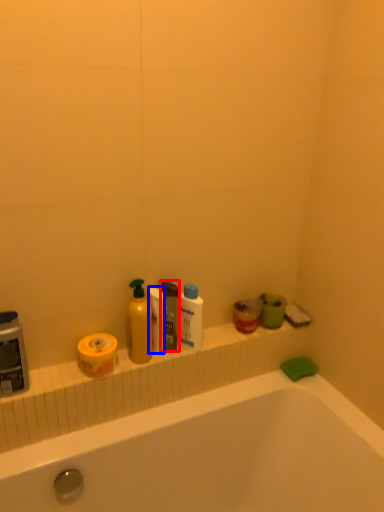
Question: Among these objects, which one is farthest to the camera, mouthwash (highlighted by a red box) or toilet paper (highlighted by a blue box)?

Choices:
 (A) mouthwash
 (B) toilet paper

Answer: (A)